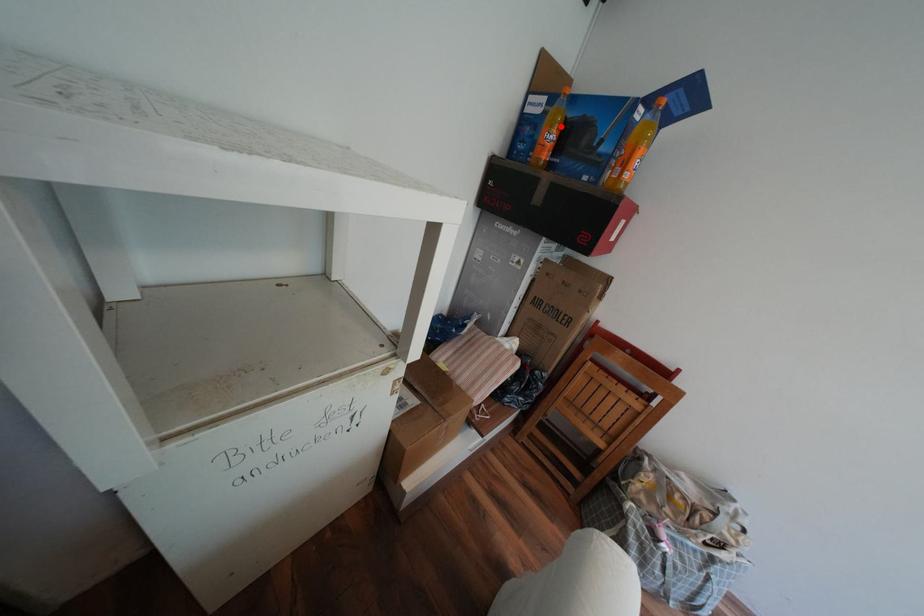
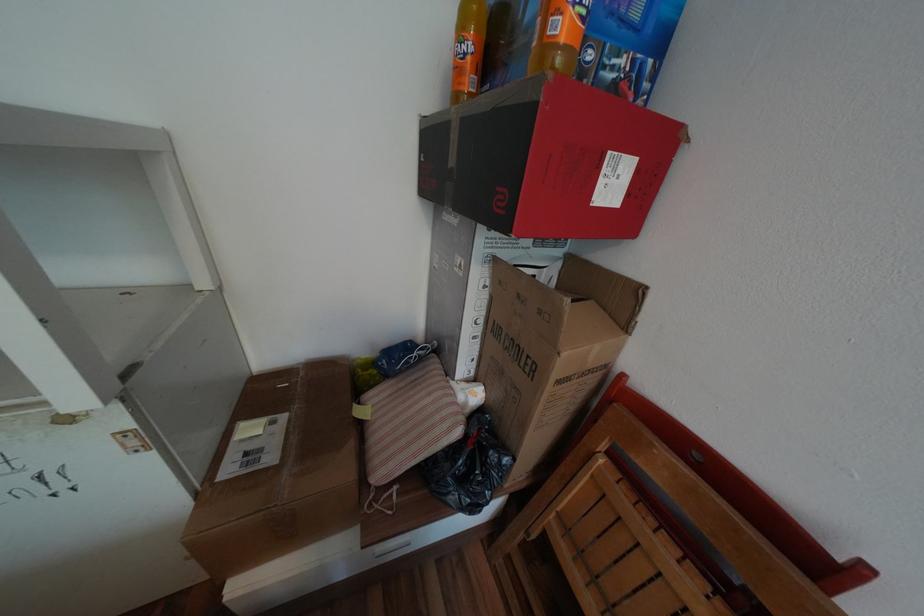
Locate, in the second image, the point that corresponds to the highlighted location in the first image.

(472, 31)